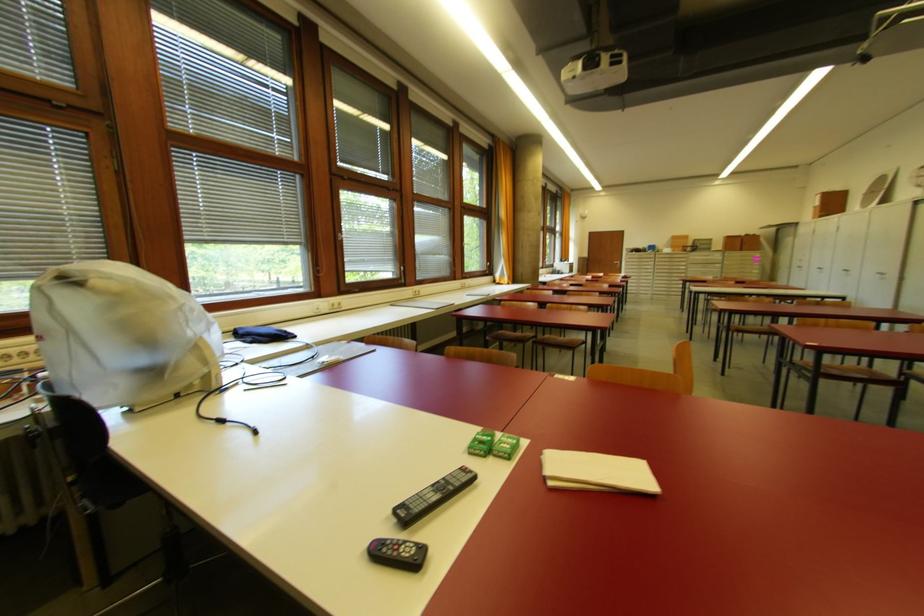
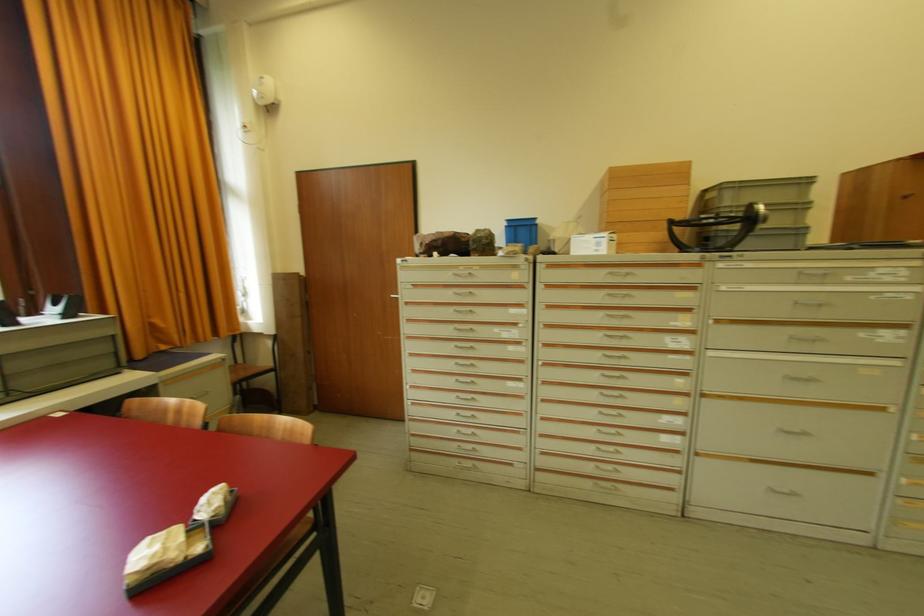
Find the pixel in the second image that matches point 675,253 in the first image.

(623, 248)